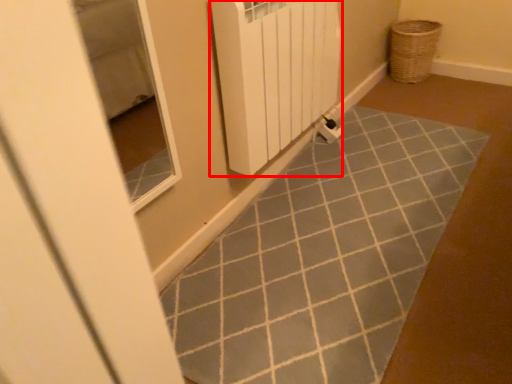
Question: From the image's perspective, what is the correct spatial relationship of radiator (annotated by the red box) in relation to basket?

Choices:
 (A) above
 (B) below

Answer: (B)